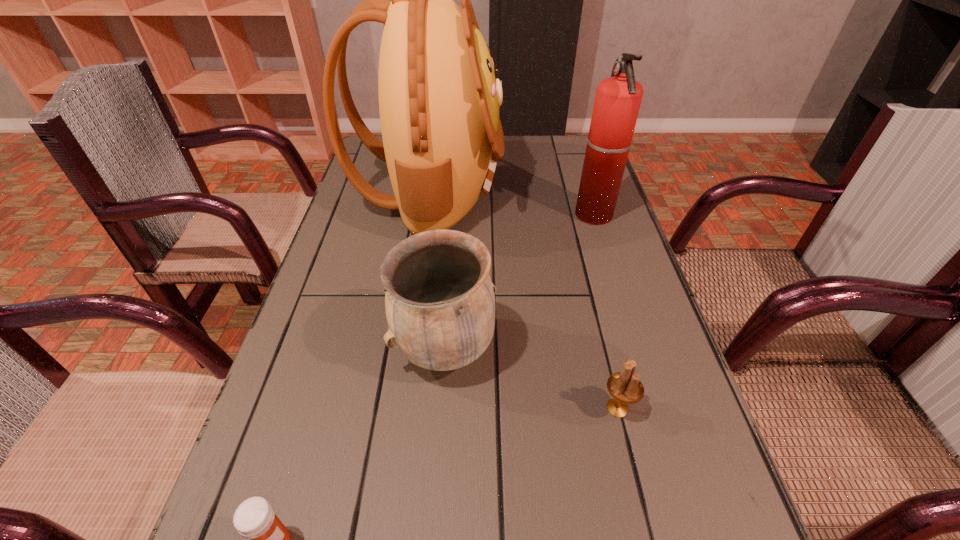
The width and height of the screenshot is (960, 540). In order to click on free spot at the far right corner of the desktop in this screenshot , I will do `click(548, 150)`.

Locate an element on the screen. This screenshot has height=540, width=960. free spot between the fire extinguisher and the second shortest object is located at coordinates (606, 312).

The image size is (960, 540). In order to click on vacant space that is in between the fire extinguisher and the tallest object in this screenshot , I will do `click(512, 203)`.

The image size is (960, 540). What are the coordinates of `free area in between the fire extinguisher and the urn` in the screenshot? It's located at (519, 282).

The image size is (960, 540). I want to click on empty location between the second nearest object and the third farthest object, so click(x=531, y=378).

Select which object is the second closest to the backpack. Please provide its 2D coordinates. Your answer should be formatted as a tuple, i.e. [(x, y)], where the tuple contains the x and y coordinates of a point satisfying the conditions above.

[(439, 298)]

Select which object is the third closest to the third farthest object. Please provide its 2D coordinates. Your answer should be formatted as a tuple, i.e. [(x, y)], where the tuple contains the x and y coordinates of a point satisfying the conditions above.

[(255, 519)]

I want to click on free spot that satisfies the following two spatial constraints: 1. on the front-facing side of the tallest object; 2. on the back side of the third farthest object, so click(405, 348).